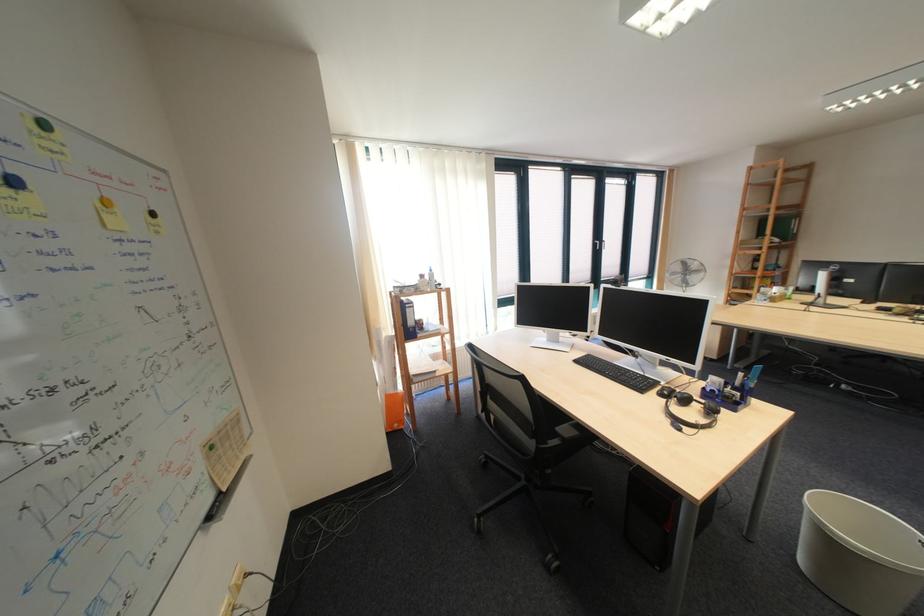
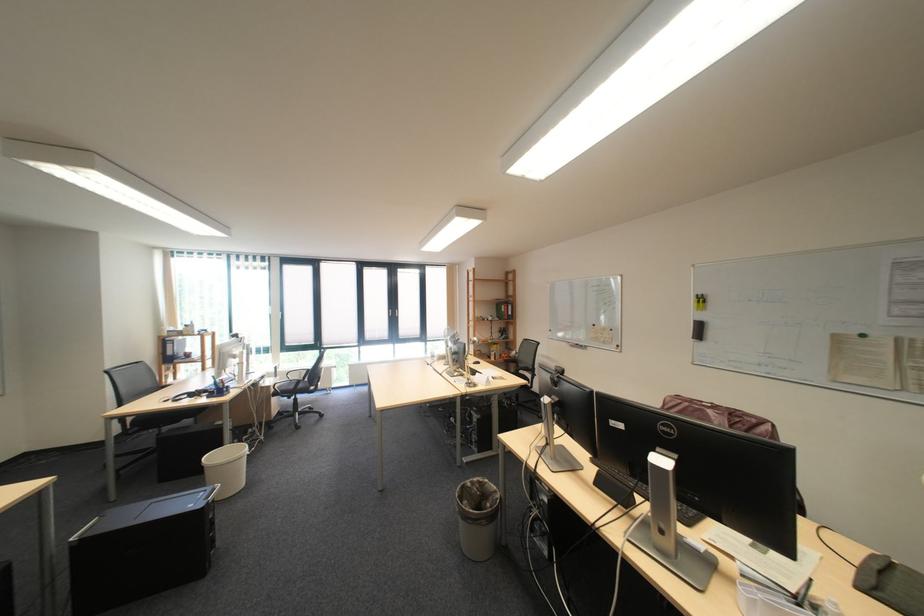
The images are taken continuously from a first-person perspective. In which direction are you moving?

The movement direction of the cameraman is right, backward.